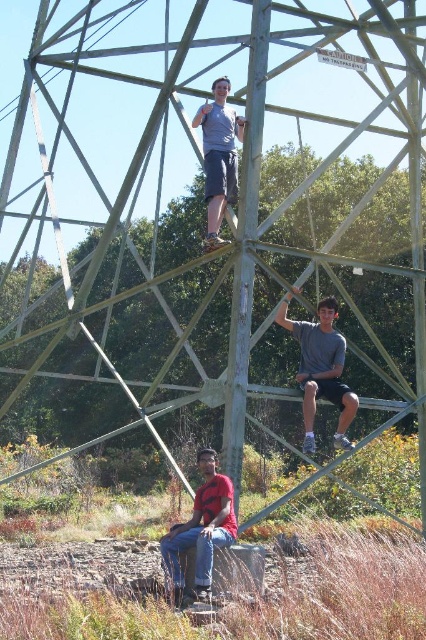
You are standing at the base of the geodesic dome and want to reach the point marked at coordinates point (304, 348). Given that the dome has a radius of 40 meters, can you safely walk directly to that point without exceeding the dome structure?

The point (304, 348) is 37.80 meters away from the viewer, which is within the dome structure since the dome has a radius of 40 meters. Therefore, you can safely walk directly to that point without exceeding the dome structure.

You are a security guard observing the scene. You need to determine which person is closer to you between the red shirt at lower center and the matte gray shirt at upper center. Based on the scene, which one is closer?

The red shirt at lower center is closer to the viewer than the matte gray shirt at upper center.